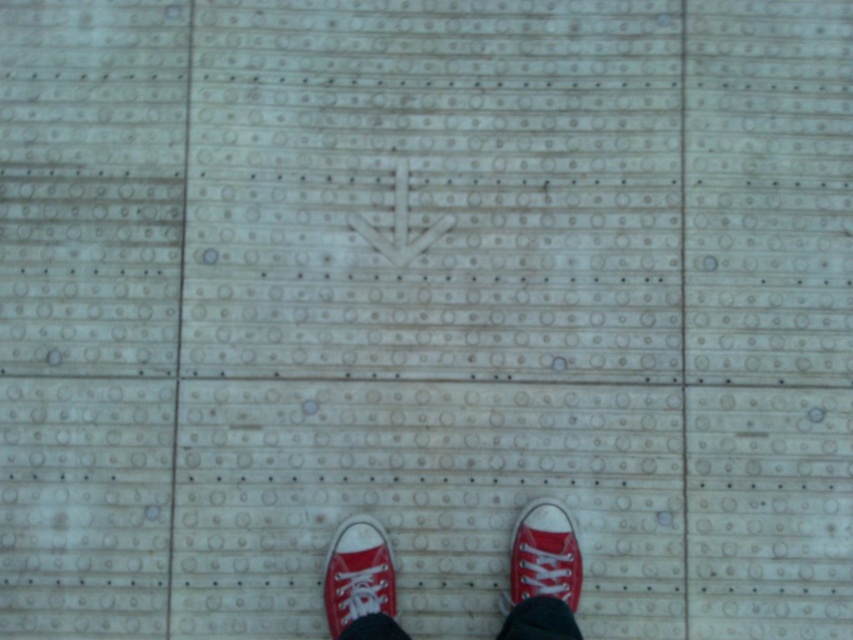
Question: Which of the following is the farthest from the observer?

Choices:
 (A) matte red sneaker at center
 (B) red canvas shoe at lower center
 (C) red canvas shoes at center

Answer: (B)

Question: Which object appears closest to the camera in this image?

Choices:
 (A) red canvas shoes at center
 (B) matte red sneaker at center

Answer: (A)

Question: Is red canvas shoes at center thinner than matte red sneaker at center?

Choices:
 (A) no
 (B) yes

Answer: (A)

Question: Which point is closer to the camera?

Choices:
 (A) (328, 584)
 (B) (527, 540)

Answer: (A)

Question: Does red canvas shoes at center lie behind matte red sneaker at center?

Choices:
 (A) no
 (B) yes

Answer: (A)

Question: Considering the relative positions of matte red sneaker at center and red canvas shoe at lower center in the image provided, where is matte red sneaker at center located with respect to red canvas shoe at lower center?

Choices:
 (A) left
 (B) right

Answer: (A)